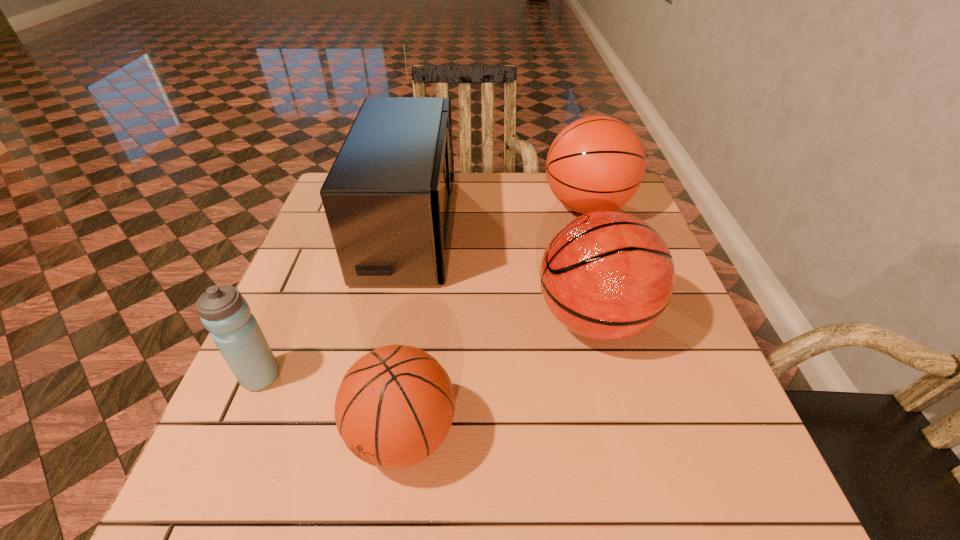
This screenshot has width=960, height=540. I want to click on blank space located on the side with spill of the second nearest basketball, so click(x=422, y=319).

Image resolution: width=960 pixels, height=540 pixels. Find the location of `vacant space situated 0.330m on the back of the water bottle`. vacant space situated 0.330m on the back of the water bottle is located at coordinates click(314, 253).

Locate an element on the screen. This screenshot has width=960, height=540. free space located 0.070m on the left of the shortest object is located at coordinates (308, 434).

The width and height of the screenshot is (960, 540). I want to click on microwave_oven positioned at the far edge, so click(x=387, y=197).

The width and height of the screenshot is (960, 540). Find the location of `basketball that is at the far edge`. basketball that is at the far edge is located at coordinates (597, 163).

The image size is (960, 540). I want to click on object that is at the near edge, so click(x=395, y=406).

At what (x,y) coordinates should I click in order to perform the action: click on microwave_oven at the left edge. Please return your answer as a coordinate pair (x, y). Image resolution: width=960 pixels, height=540 pixels. Looking at the image, I should click on (387, 197).

Where is `water bottle present at the left edge`? This screenshot has height=540, width=960. water bottle present at the left edge is located at coordinates (224, 312).

This screenshot has width=960, height=540. I want to click on object located at the far left corner, so click(x=387, y=197).

The width and height of the screenshot is (960, 540). What are the coordinates of `object that is at the far right corner` in the screenshot? It's located at (597, 163).